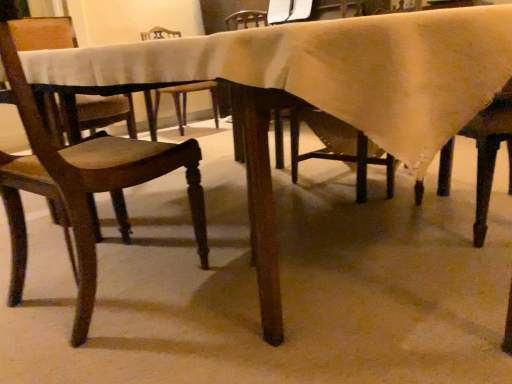
Question: Should I look upward or downward to see wooden chair at left?

Choices:
 (A) up
 (B) down

Answer: (A)